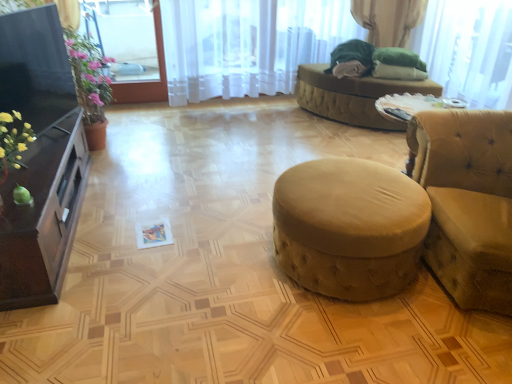
Find the location of a particular element. Image resolution: width=512 pixels, height=384 pixels. velvet yellow studio couch at right is located at coordinates (467, 202).

Describe the element at coordinates (354, 96) in the screenshot. Image resolution: width=512 pixels, height=384 pixels. I see `beige fabric ottoman at center` at that location.

Image resolution: width=512 pixels, height=384 pixels. Describe the element at coordinates (42, 215) in the screenshot. I see `matte black cabinet at left` at that location.

Where is `green fabric at upper right`? The height and width of the screenshot is (384, 512). green fabric at upper right is located at coordinates (351, 59).

The width and height of the screenshot is (512, 384). What are the coordinates of `suede-like beige stool at center` in the screenshot? It's located at (349, 227).

Is point (258, 2) in front of point (428, 167)?

No, it is behind (428, 167).

In the scene shown: Is white sheer curtain at upper center bigger or smaller than velvet yellow studio couch at right?

In the image, white sheer curtain at upper center appears to be smaller than velvet yellow studio couch at right.

Based on the photo, from the image's perspective, is white sheer curtain at upper center over velvet yellow studio couch at right?

Yes, from the image's perspective, white sheer curtain at upper center is on top of velvet yellow studio couch at right.

Considering the positions of objects white sheer curtain at upper center and clear glass window at upper left, the first window screen in the left-to-right sequence, in the image provided, who is behind, white sheer curtain at upper center or clear glass window at upper left, the first window screen in the left-to-right sequence,?

clear glass window at upper left, the first window screen in the left-to-right sequence, is behind.

Can you confirm if white sheer curtain at upper center is smaller than clear glass window at upper left, positioned as the second window screen in right-to-left order?

Actually, white sheer curtain at upper center might be larger than clear glass window at upper left, positioned as the second window screen in right-to-left order.

From the picture: From a real-world perspective, is white sheer curtain at upper center above or below clear glass window at upper left, the first window screen in the left-to-right sequence?

Clearly, from a real-world perspective, white sheer curtain at upper center is above clear glass window at upper left, the first window screen in the left-to-right sequence.

Considering the sizes of white sheer curtain at upper center and clear glass window at upper left, positioned as the second window screen in right-to-left order, in the image, is white sheer curtain at upper center taller or shorter than clear glass window at upper left, positioned as the second window screen in right-to-left order,?

Considering their sizes, white sheer curtain at upper center has less height than clear glass window at upper left, positioned as the second window screen in right-to-left order.

Consider the image. Is translucent fabric at upper right, which is the second window screen from left to right, to the right of green fabric at upper right from the viewer's perspective?

Yes, translucent fabric at upper right, which is the second window screen from left to right, is to the right of green fabric at upper right.

Is translucent fabric at upper right, which is the second window screen from left to right, oriented away from green fabric at upper right?

No, green fabric at upper right is not at the back of translucent fabric at upper right, which is the second window screen from left to right.

Which of these two, translucent fabric at upper right, arranged as the 1th window screen when viewed from the right, or green fabric at upper right, is wider?

green fabric at upper right.

Is green fabric at upper right completely or partially inside translucent fabric at upper right, arranged as the 1th window screen when viewed from the right?

No, translucent fabric at upper right, arranged as the 1th window screen when viewed from the right, does not contain green fabric at upper right.

Which object is further away from the camera, velvet beige ottoman at center or velvet yellow studio couch at right?

velvet beige ottoman at center is behind.

Who is shorter, velvet beige ottoman at center or velvet yellow studio couch at right?

velvet beige ottoman at center is shorter.

From the image's perspective, is velvet beige ottoman at center located above velvet yellow studio couch at right?

Yes, from the image's perspective, velvet beige ottoman at center is above velvet yellow studio couch at right.

From a real-world perspective, which object stands above the other?

From a 3D spatial view, velvet yellow studio couch at right is above.

Which is more to the right, clear glass window at upper left, positioned as the second window screen in right-to-left order, or white sheer curtain at upper center?

Positioned to the right is white sheer curtain at upper center.

Which of these two, clear glass window at upper left, the first window screen in the left-to-right sequence, or white sheer curtain at upper center, is thinner?

Thinner between the two is clear glass window at upper left, the first window screen in the left-to-right sequence.

Is point (129, 13) closer to camera compared to point (255, 93)?

Yes, it is.

Based on the photo, is matte black cabinet at left inside or outside of suede-like beige stool at center?

Result: matte black cabinet at left is outside suede-like beige stool at center.

Is matte black cabinet at left at the left side of suede-like beige stool at center?

Correct, you'll find matte black cabinet at left to the left of suede-like beige stool at center.

Are matte black cabinet at left and suede-like beige stool at center far apart?

matte black cabinet at left is far away from suede-like beige stool at center.

How different are the orientations of matte black cabinet at left and suede-like beige stool at center in degrees?

The angle between the facing direction of matte black cabinet at left and the facing direction of suede-like beige stool at center is 89.7 degrees.

Is white sheer curtain at upper center aimed at matte black cabinet at left?

Yes, white sheer curtain at upper center is facing matte black cabinet at left.

Which is more to the left, white sheer curtain at upper center or matte black cabinet at left?

Positioned to the left is matte black cabinet at left.

How far apart are white sheer curtain at upper center and matte black cabinet at left?

white sheer curtain at upper center and matte black cabinet at left are 2.20 meters apart from each other.

Which is further, (202,94) or (47,155)?

The point (202,94) is farther from the camera.

This screenshot has height=384, width=512. What are the coordinates of `curtain that is above the velvet yellow studio couch at right (from a real-world perspective)` in the screenshot? It's located at (x=247, y=44).

Locate an element on the screen. The width and height of the screenshot is (512, 384). window screen behind the white sheer curtain at upper center is located at coordinates (124, 35).

Which object lies nearer to the anchor point clear glass window at upper left, positioned as the second window screen in right-to-left order, suede-like beige stool at center or white sheer curtain at upper center?

Based on the image, white sheer curtain at upper center appears to be nearer to clear glass window at upper left, positioned as the second window screen in right-to-left order.

Which object lies further to the anchor point white sheer curtain at upper center, velvet beige ottoman at center or suede-like beige stool at center?

suede-like beige stool at center is positioned further to the anchor white sheer curtain at upper center.

From the image, which object appears to be nearer to clear glass window at upper left, positioned as the second window screen in right-to-left order, suede-like beige stool at center or velvet yellow studio couch at right?

Based on the image, suede-like beige stool at center appears to be nearer to clear glass window at upper left, positioned as the second window screen in right-to-left order.

Looking at the image, which one is located closer to beige fabric ottoman at center, green fabric at upper right or suede-like beige stool at center?

Among the two, green fabric at upper right is located nearer to beige fabric ottoman at center.

When comparing their distances from velvet yellow studio couch at right, does white sheer curtain at upper center or translucent fabric at upper right, which is the second window screen from left to right, seem further?

Based on the image, white sheer curtain at upper center appears to be further to velvet yellow studio couch at right.

Estimate the real-world distances between objects in this image. Which object is closer to velvet beige ottoman at center, clear glass window at upper left, positioned as the second window screen in right-to-left order, or green fabric at upper right?

The object closer to velvet beige ottoman at center is green fabric at upper right.

Which object lies further to the anchor point clear glass window at upper left, positioned as the second window screen in right-to-left order, white sheer curtain at upper center or matte black cabinet at left?

matte black cabinet at left lies further to clear glass window at upper left, positioned as the second window screen in right-to-left order, than the other object.

Based on their spatial positions, is velvet yellow studio couch at right or clear glass window at upper left, the first window screen in the left-to-right sequence, closer to translucent fabric at upper right, arranged as the 1th window screen when viewed from the right?

velvet yellow studio couch at right is closer to translucent fabric at upper right, arranged as the 1th window screen when viewed from the right.

Image resolution: width=512 pixels, height=384 pixels. What are the coordinates of `window screen between suede-like beige stool at center and white sheer curtain at upper center in the front-back direction` in the screenshot? It's located at (469, 49).

This screenshot has width=512, height=384. I want to click on stool positioned between velvet yellow studio couch at right and green fabric at upper right from near to far, so click(349, 227).

Identify the location of round table between matte black cabinet at left and velvet yellow studio couch at right from left to right. This screenshot has width=512, height=384. (410, 105).

I want to click on open between velvet yellow studio couch at right and clear glass window at upper left, positioned as the second window screen in right-to-left order, along the z-axis, so coord(351,59).